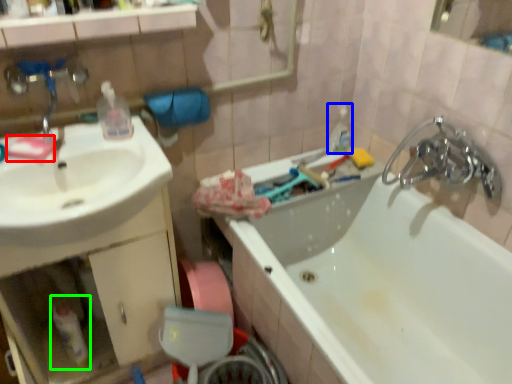
Question: Based on their relative distances, which object is nearer to soap (highlighted by a red box)? Choose from toiletry (highlighted by a blue box) and bottle (highlighted by a green box).

Choices:
 (A) toiletry
 (B) bottle

Answer: (B)